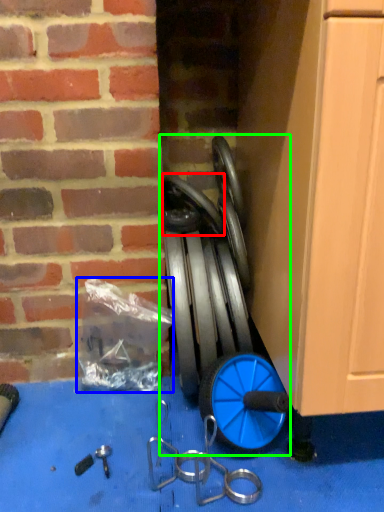
Question: Based on their relative distances, which object is farther from wheel (highlighted by a red box)? Choose from garbage (highlighted by a blue box) and garden hose (highlighted by a green box).

Choices:
 (A) garbage
 (B) garden hose

Answer: (A)